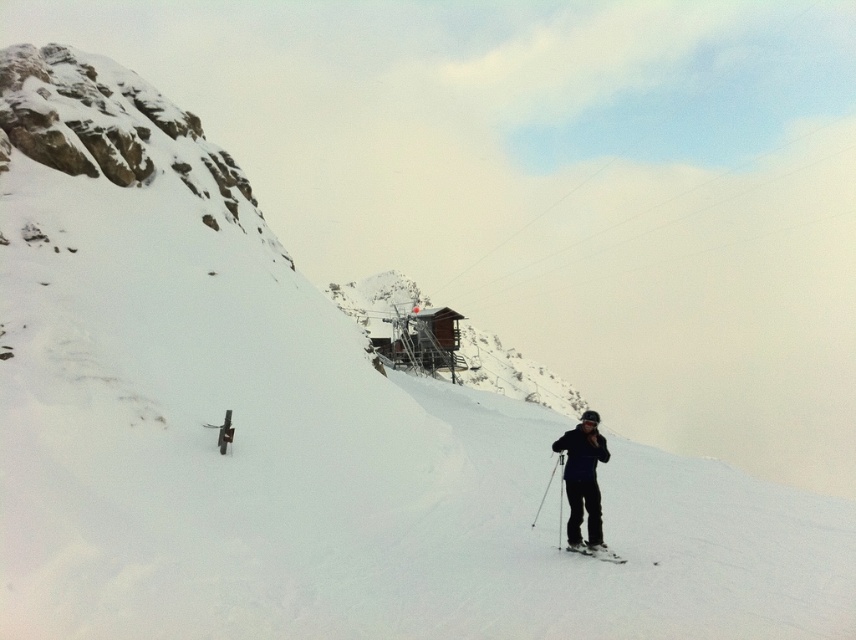
Find the location of a particular element. matte black ski suit at lower right is located at coordinates (583, 477).

Can you confirm if matte black ski suit at lower right is shorter than white matte ski at lower right?

In fact, matte black ski suit at lower right may be taller than white matte ski at lower right.

What are the coordinates of `matte black ski suit at lower right` in the screenshot? It's located at (583, 477).